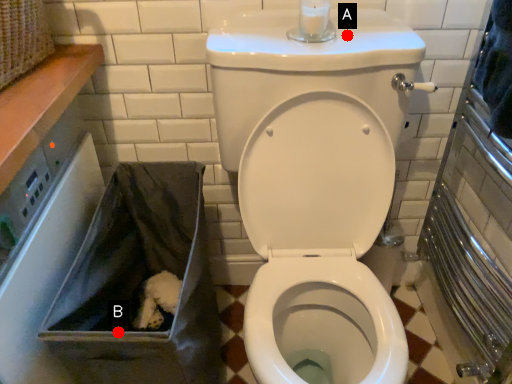
Question: Two points are circled on the image, labeled by A and B beside each circle. Which of the following is the farthest from the observer?

Choices:
 (A) A is further
 (B) B is further

Answer: (A)